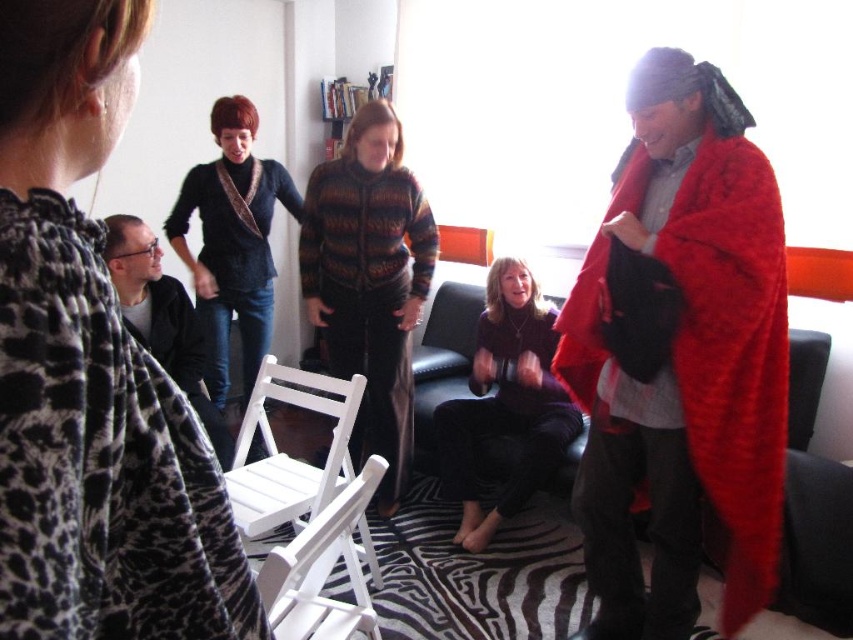
Find the location of `knitted sweater at center`. knitted sweater at center is located at coordinates (369, 282).

Who is more distant from viewer, [380,332] or [335,560]?

Positioned behind is point [380,332].

The height and width of the screenshot is (640, 853). I want to click on knitted sweater at center, so click(369, 282).

Who is more distant from viewer, [16,19] or [334,412]?

The point [334,412] is behind.

Can you confirm if matte black sweater at center is thinner than white wood chair at lower left?

Yes.

Is point (190, 468) closer to viewer compared to point (299, 397)?

Yes, it is.

This screenshot has height=640, width=853. I want to click on matte black sweater at center, so click(91, 372).